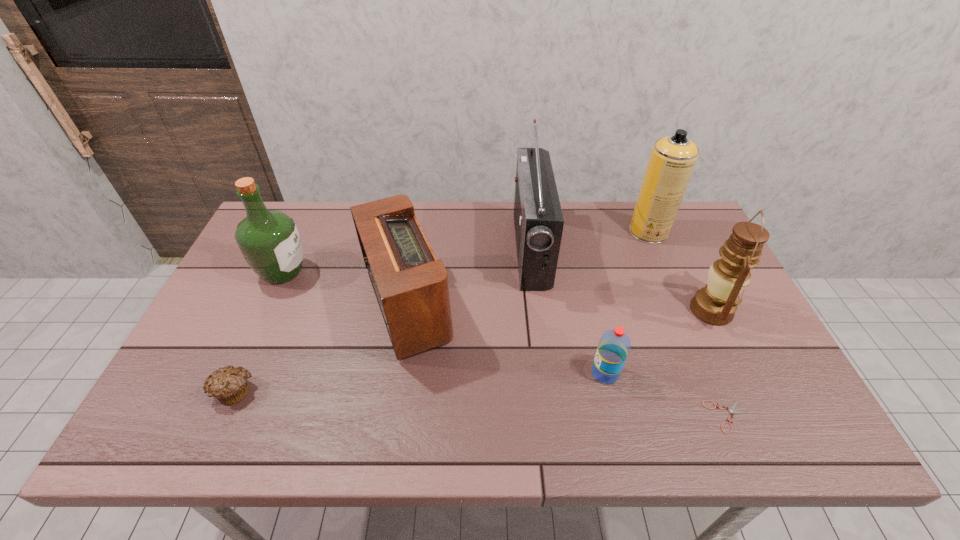
This screenshot has width=960, height=540. I want to click on the taller radio receiver, so click(x=538, y=220).

Locate an element on the screen. This screenshot has width=960, height=540. the fifth object from right to left is located at coordinates (538, 220).

Where is `aerosol can`? The image size is (960, 540). aerosol can is located at coordinates (672, 160).

Where is `oil lamp`? Image resolution: width=960 pixels, height=540 pixels. oil lamp is located at coordinates (716, 303).

Where is `liquor`? The height and width of the screenshot is (540, 960). liquor is located at coordinates (269, 240).

Identify the location of the shorter radio receiver. (411, 285).

You are a GUI agent. You are given a task and a screenshot of the screen. Output one action in this format:
    pyautogui.click(x=<x>, y=<y>)
    Task: Click on the fourth shortest object
    Image resolution: width=960 pixels, height=540 pixels.
    Given the screenshot: What is the action you would take?
    pyautogui.click(x=411, y=285)

At what (x,y) coordinates should I click in order to perform the action: click on the fifth object from left to right. Please return your answer as a coordinate pair (x, y). The height and width of the screenshot is (540, 960). Looking at the image, I should click on (614, 345).

Image resolution: width=960 pixels, height=540 pixels. What are the coordinates of `the third shortest object` in the screenshot? It's located at (614, 345).

Image resolution: width=960 pixels, height=540 pixels. I want to click on the seventh tallest object, so click(229, 385).